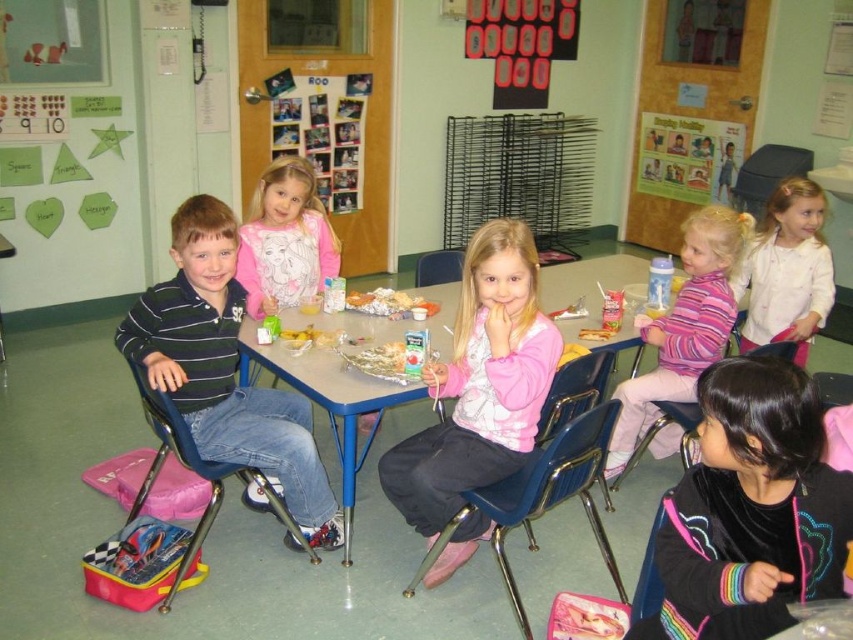
You are standing at the camera position in the classroom. There is a metallic blue chair at left. Can you reach the chair within 3 steps without moving around any obstacles?

The distance between the metallic blue chair at left and the camera is 7.33 feet. Since 3 steps would cover approximately 9 feet on average, you can likely reach the chair within 3 steps without needing to move around obstacles.

Looking at this image, you are a teacher trying to organize the classroom. You need to place a new poster that requires 1 meter of space between the white cotton shirt at upper right and the blue plastic chair at lower right. Based on their positions, do you think there is enough space?

The white cotton shirt at upper right might be wider than blue plastic chair at lower right, so there might not be enough space for the poster requiring 1 meter between them.